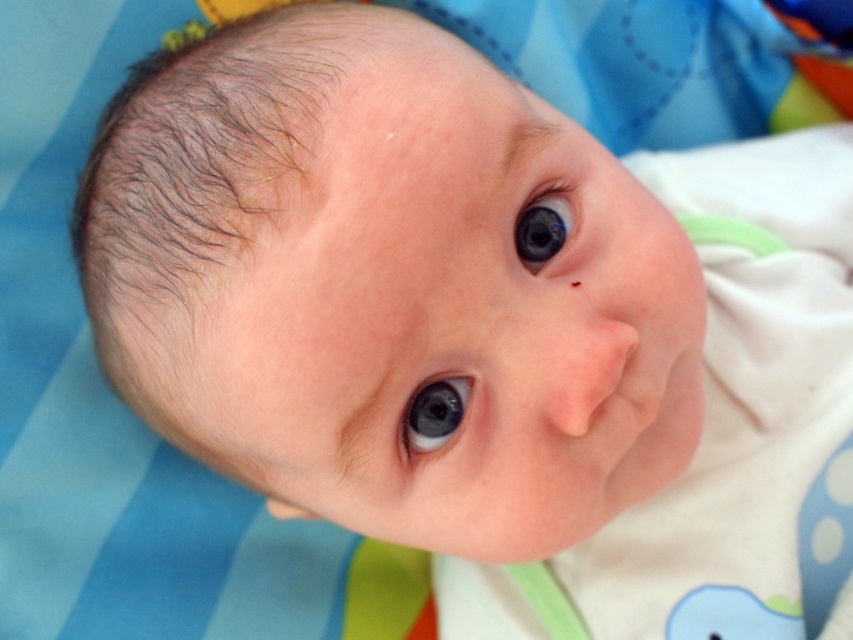
Question: Which object is closer to the camera taking this photo?

Choices:
 (A) glossy blue eye at upper center
 (B) blue glossy eye at center

Answer: (B)

Question: Can you confirm if blue glossy eye at center is wider than glossy blue eye at upper center?

Choices:
 (A) yes
 (B) no

Answer: (A)

Question: Is blue glossy eye at center further to camera compared to glossy blue eye at upper center?

Choices:
 (A) yes
 (B) no

Answer: (B)

Question: Which point is farther to the camera?

Choices:
 (A) (526, 227)
 (B) (413, 445)

Answer: (B)

Question: Can you confirm if blue glossy eye at center is smaller than glossy blue eye at upper center?

Choices:
 (A) yes
 (B) no

Answer: (A)